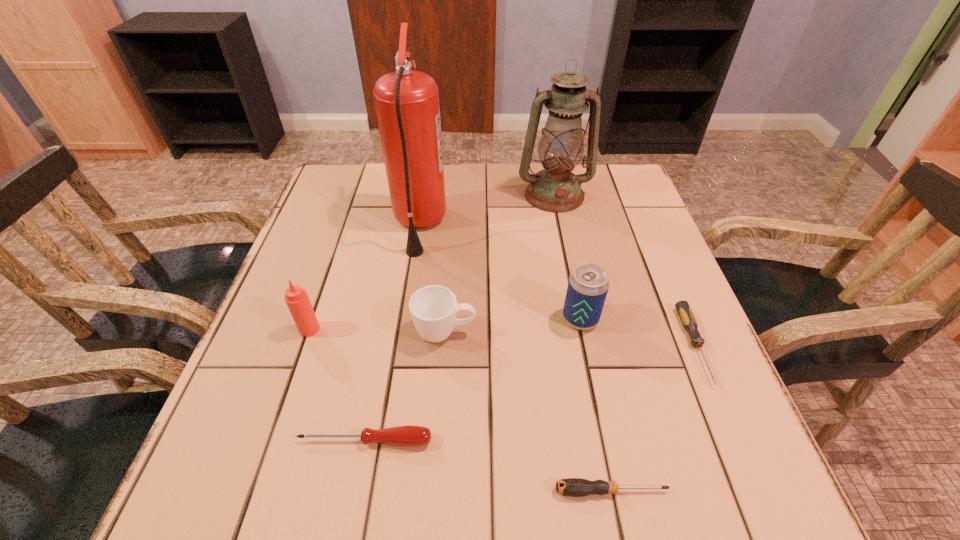
You are a GUI agent. You are given a task and a screenshot of the screen. Output one action in this format:
    pyautogui.click(x=<x>, y=<y>)
    Task: Click on the free space at the right edge
    
    Given the screenshot: What is the action you would take?
    pyautogui.click(x=591, y=219)

In the image, there is a desktop. Identify the location of vacant space at the far left corner. The height and width of the screenshot is (540, 960). (337, 176).

Locate an element on the screen. The image size is (960, 540). vacant space at the near left corner is located at coordinates click(x=284, y=495).

Locate an element on the screen. The image size is (960, 540). vacant space at the far right corner of the desktop is located at coordinates (623, 167).

Locate an element on the screen. vacant region at the near right corner of the desktop is located at coordinates (x=703, y=511).

Locate an element on the screen. Image resolution: width=960 pixels, height=540 pixels. vacant region between the rightmost screwdriver and the fire extinguisher is located at coordinates (557, 285).

The height and width of the screenshot is (540, 960). I want to click on empty space that is in between the Tabasco sauce and the tallest screwdriver, so click(x=338, y=385).

Identify the location of empty space that is in between the oil lamp and the farthest screwdriver. The width and height of the screenshot is (960, 540). (625, 271).

Locate an element on the screen. This screenshot has height=540, width=960. vacant space in between the tallest object and the seventh shortest object is located at coordinates (487, 210).

Image resolution: width=960 pixels, height=540 pixels. I want to click on unoccupied position between the rightmost object and the second screwdriver from left to right, so click(653, 418).